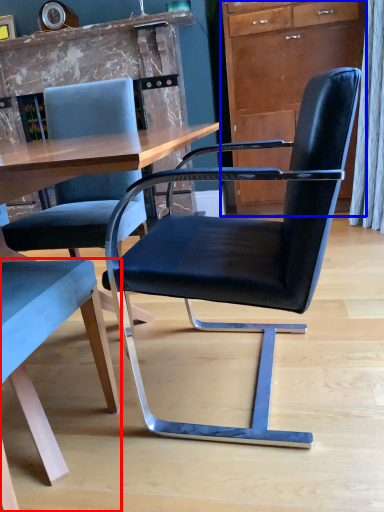
Question: Which object appears closest to the camera in this image, chair (highlighted by a red box) or cabinetry (highlighted by a blue box)?

Choices:
 (A) chair
 (B) cabinetry

Answer: (A)